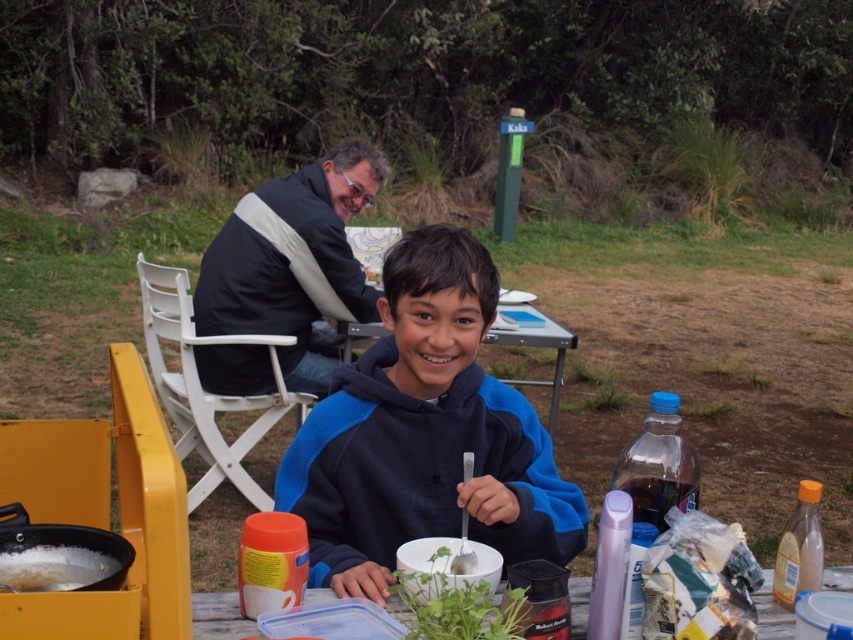
You are planning to set up a small tent near the dark blue jacket at upper left and the white plastic picnic table at center. Based on the space they occupy, which location would be more suitable for placing the tent?

The white plastic picnic table at center occupies more space than the dark blue jacket at upper left, so the area around the dark blue jacket at upper left would be more suitable for placing the tent since there is more available space.

What is the object located at the point with coordinates (293, 262)?

The point at coordinates (293, 262) marks the dark blue jacket at upper left.